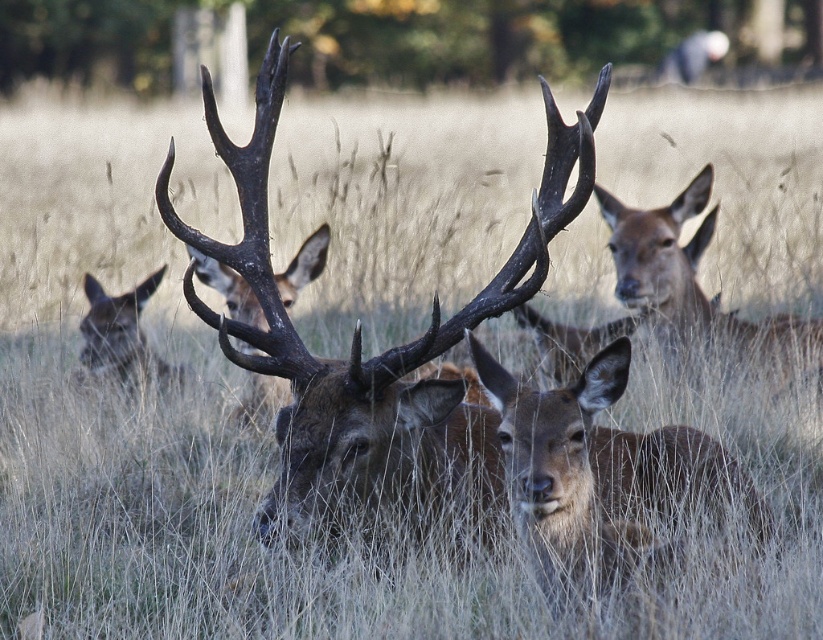
Question: Which point is farther from the camera taking this photo?

Choices:
 (A) (797, 342)
 (B) (310, 376)

Answer: (A)

Question: Can you confirm if brown matte/deer at center is positioned below brown matte/deer at upper center?

Choices:
 (A) yes
 (B) no

Answer: (A)

Question: Which of the following is the closest to the observer?

Choices:
 (A) brown matte/deer at upper center
 (B) brown textured fur at center

Answer: (B)

Question: In this image, where is brown textured fur at center located relative to brown matte/deer at upper center?

Choices:
 (A) right
 (B) left

Answer: (B)

Question: Based on their relative distances, which object is nearer to the brown matte/deer at upper center?

Choices:
 (A) brown textured fur at center
 (B) brown matte/deer at center

Answer: (B)

Question: Is brown textured fur at center positioned behind brown matte/deer at center?

Choices:
 (A) yes
 (B) no

Answer: (B)